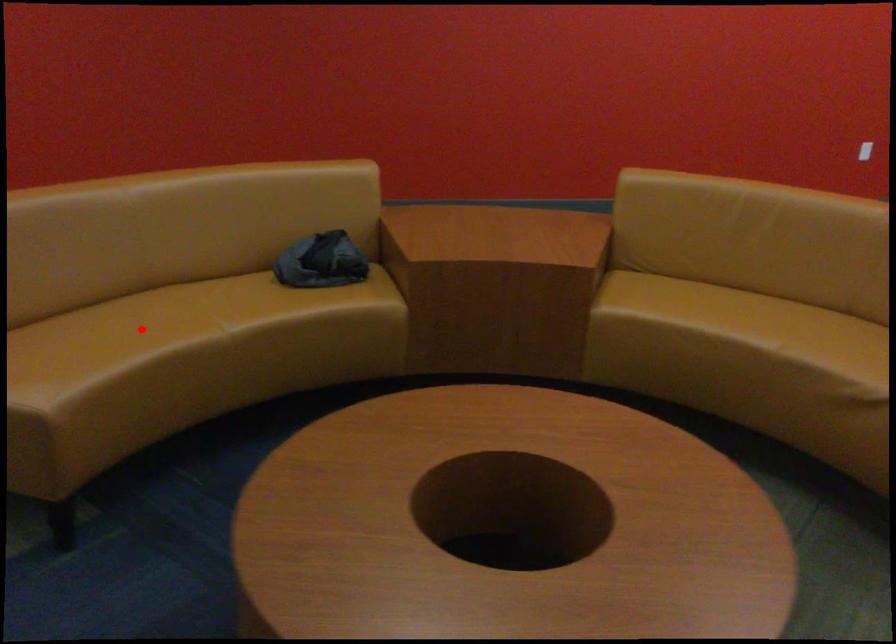
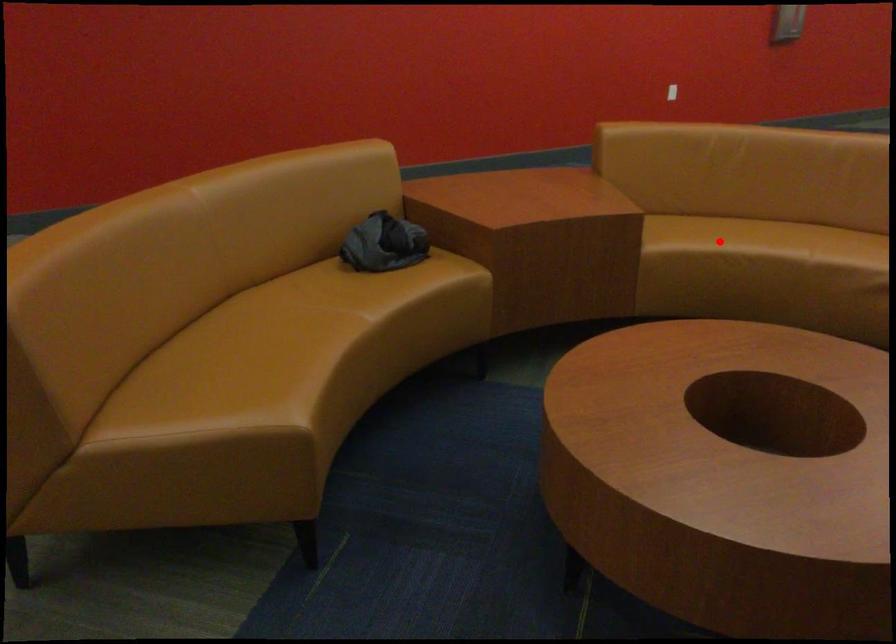
I am providing you with two images of the same scene from different viewpoints. A red point is marked on the first image and another point is marked on the second image. Are the points marked in image1 and image2 representing the same 3D position?

No